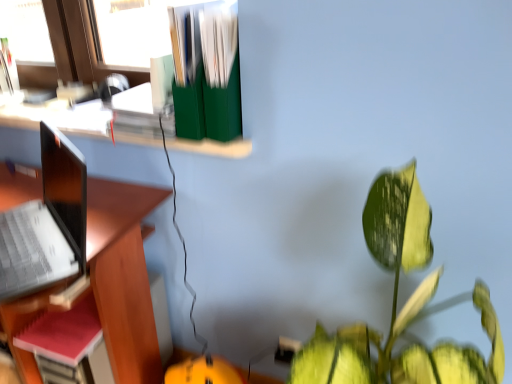
You are a GUI agent. You are given a task and a screenshot of the screen. Output one action in this format:
    pyautogui.click(x=<x>, y=<y>)
    Task: Click on the free space above red matte notebook at left (from a real-world perspective)
    The width and height of the screenshot is (512, 384).
    Given the screenshot: What is the action you would take?
    pyautogui.click(x=70, y=323)